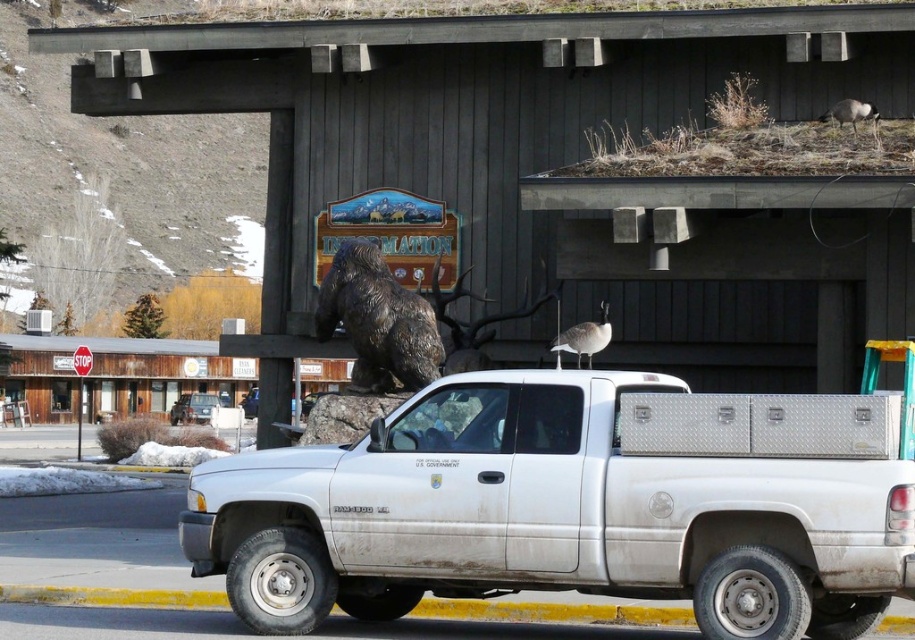
Question: Can you confirm if white aluminum truck at center is positioned to the left of gray feathered goose at upper center?

Choices:
 (A) yes
 (B) no

Answer: (A)

Question: Which object is farther from the camera taking this photo?

Choices:
 (A) white aluminum truck at center
 (B) bronze statue at center
 (C) gray feathered goose at upper center

Answer: (B)

Question: Which of the following is the farthest from the observer?

Choices:
 (A) bronze statue at center
 (B) white aluminum truck at center

Answer: (A)

Question: Estimate the real-world distances between objects in this image. Which object is closer to the white aluminum truck at center?

Choices:
 (A) gray feathered goose at upper center
 (B) bronze statue at center

Answer: (A)

Question: Does bronze statue at center have a larger size compared to gray feathered goose at upper center?

Choices:
 (A) no
 (B) yes

Answer: (A)

Question: Is bronze statue at center smaller than gray feathered goose at upper center?

Choices:
 (A) yes
 (B) no

Answer: (A)